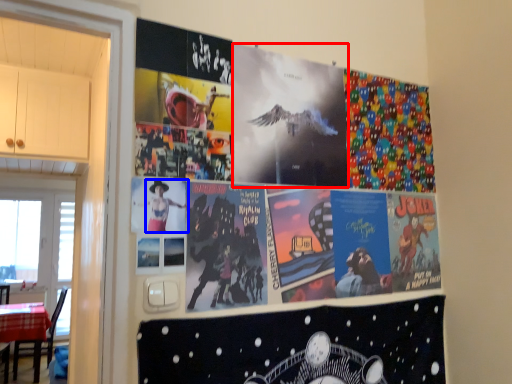
Question: Which of the following is the closest to the observer, movie poster (highlighted by a red box) or person (highlighted by a blue box)?

Choices:
 (A) movie poster
 (B) person

Answer: (B)